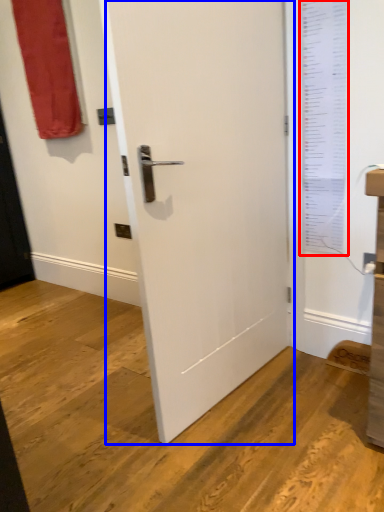
Question: Which of the following is the farthest to the observer, window screen (highlighted by a red box) or door (highlighted by a blue box)?

Choices:
 (A) window screen
 (B) door

Answer: (A)